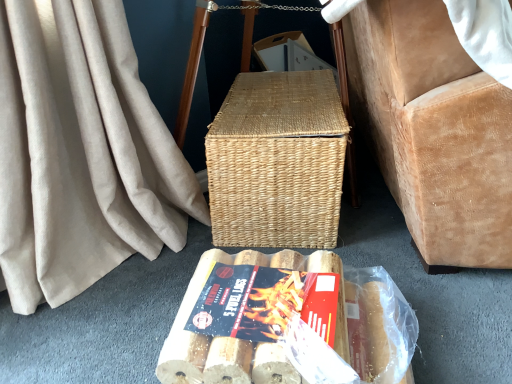
In order to face wooden logs at lower center, should I rotate leftwards or rightwards?

You should look right and rotate roughly 4.104 degrees.

At what (x,y) coordinates should I click in order to perform the action: click on suede armchair at right. Please return your answer as a coordinate pair (x, y). Looking at the image, I should click on (433, 131).

The height and width of the screenshot is (384, 512). What do you see at coordinates (433, 131) in the screenshot? I see `suede armchair at right` at bounding box center [433, 131].

You are a GUI agent. You are given a task and a screenshot of the screen. Output one action in this format:
    pyautogui.click(x=<x>, y=<y>)
    Task: Click on the wooden logs at lower center
    
    Given the screenshot: What is the action you would take?
    pyautogui.click(x=288, y=322)

Is suede armchair at right closer to the viewer compared to woven natural picnic basket at center?

Yes, suede armchair at right is closer to the camera.

Does suede armchair at right have a greater width compared to woven natural picnic basket at center?

Yes, suede armchair at right is wider than woven natural picnic basket at center.

Is suede armchair at right oriented towards woven natural picnic basket at center?

No, suede armchair at right is not turned towards woven natural picnic basket at center.

Could woven natural picnic basket at center be considered to be inside wooden logs at lower center?

No, woven natural picnic basket at center is not a part of wooden logs at lower center.

Based on their sizes in the image, would you say wooden logs at lower center is bigger or smaller than woven natural picnic basket at center?

wooden logs at lower center is smaller than woven natural picnic basket at center.

From a real-world perspective, does wooden logs at lower center stand above woven natural picnic basket at center?

No, from a real-world perspective, wooden logs at lower center is not on top of woven natural picnic basket at center.

Which is less distant, (288, 329) or (264, 101)?

Point (288, 329) is positioned closer to the camera compared to point (264, 101).

Can you confirm if woven natural picnic basket at center is taller than wooden textured logs at center?

Yes, woven natural picnic basket at center is taller than wooden textured logs at center.

Considering the positions of objects woven natural picnic basket at center and wooden textured logs at center in the image provided, who is in front, woven natural picnic basket at center or wooden textured logs at center?

wooden textured logs at center.

How different are the orientations of woven natural picnic basket at center and wooden textured logs at center in degrees?

There is a 99.9-degree angle between the facing directions of woven natural picnic basket at center and wooden textured logs at center.

From a real-world perspective, between woven natural picnic basket at center and wooden textured logs at center, who is vertically higher?

woven natural picnic basket at center is physically above.

From the image's perspective, is suede armchair at right on top of wooden textured logs at center?

Yes, from the image's perspective, suede armchair at right is above wooden textured logs at center.

Is suede armchair at right with wooden textured logs at center?

No.

How distant is suede armchair at right from wooden textured logs at center?

47.72 centimeters.

Does wooden logs at lower center have a lesser width compared to suede armchair at right?

Yes.

Considering the sizes of objects wooden logs at lower center and suede armchair at right in the image provided, who is taller, wooden logs at lower center or suede armchair at right?

With more height is suede armchair at right.

Looking at this image, what's the angular difference between wooden logs at lower center and suede armchair at right's facing directions?

They differ by 5.95 degrees in their facing directions.

From a real-world perspective, which is physically below, wooden logs at lower center or suede armchair at right?

wooden logs at lower center, from a real-world perspective.

Between woven natural picnic basket at center and wooden logs at lower center, which one appears on the right side from the viewer's perspective?

woven natural picnic basket at center is more to the right.

Does woven natural picnic basket at center have a greater width compared to wooden logs at lower center?

In fact, woven natural picnic basket at center might be narrower than wooden logs at lower center.

Is point (298, 133) behind point (277, 297)?

Yes, it is behind point (277, 297).

From the picture: Which object is further away from the camera taking this photo, wooden logs at lower center or wooden textured logs at center?

wooden textured logs at center is more distant.

From the picture: Who is smaller, wooden logs at lower center or wooden textured logs at center?

wooden textured logs at center.

From the image's perspective, is wooden logs at lower center under wooden textured logs at center?

Yes, from the image's perspective, wooden logs at lower center is below wooden textured logs at center.

Find the location of a particular element. The height and width of the screenshot is (384, 512). furniture on the right of woven natural picnic basket at center is located at coordinates (433, 131).

Where is `food on the left of woven natural picnic basket at center`? The height and width of the screenshot is (384, 512). food on the left of woven natural picnic basket at center is located at coordinates (288, 322).

When comparing their distances from wooden logs at lower center, does woven natural picnic basket at center or wooden textured logs at center seem further?

Among the two, woven natural picnic basket at center is located further to wooden logs at lower center.

From the image, which object appears to be farther from woven natural picnic basket at center, suede armchair at right or wooden logs at lower center?

The object further to woven natural picnic basket at center is wooden logs at lower center.

When comparing their distances from suede armchair at right, does woven natural picnic basket at center or wooden textured logs at center seem closer?

The object closer to suede armchair at right is woven natural picnic basket at center.

When comparing their distances from woven natural picnic basket at center, does wooden logs at lower center or suede armchair at right seem further?

Among the two, wooden logs at lower center is located further to woven natural picnic basket at center.

Which object lies nearer to the anchor point suede armchair at right, wooden textured logs at center or wooden logs at lower center?

wooden logs at lower center is closer to suede armchair at right.

Estimate the real-world distances between objects in this image. Which object is further from suede armchair at right, wooden logs at lower center or woven natural picnic basket at center?

wooden logs at lower center lies further to suede armchair at right than the other object.

Which object lies nearer to the anchor point wooden textured logs at center, suede armchair at right or wooden logs at lower center?

wooden logs at lower center.

Estimate the real-world distances between objects in this image. Which object is closer to suede armchair at right, woven natural picnic basket at center or wooden logs at lower center?

woven natural picnic basket at center is closer to suede armchair at right.

You are a GUI agent. You are given a task and a screenshot of the screen. Output one action in this format:
    pyautogui.click(x=<x>, y=<y>)
    Task: Click on the picnic basket located between wooden textured logs at center and suede armchair at right in the left-right direction
    
    Given the screenshot: What is the action you would take?
    pyautogui.click(x=277, y=161)

This screenshot has height=384, width=512. I want to click on paperback book between woven natural picnic basket at center and wooden logs at lower center in the up-down direction, so coord(248,302).

Image resolution: width=512 pixels, height=384 pixels. I want to click on picnic basket between wooden logs at lower center and suede armchair at right in the horizontal direction, so click(277, 161).

Where is `food situated between wooden textured logs at center and suede armchair at right from left to right`? The height and width of the screenshot is (384, 512). food situated between wooden textured logs at center and suede armchair at right from left to right is located at coordinates (288, 322).